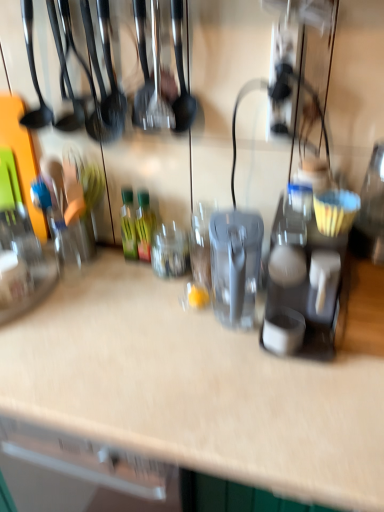
Question: Does green glass bottle at center, the 2th bottle when ordered from right to left, turn towards matte gray coffee maker at center right?

Choices:
 (A) yes
 (B) no

Answer: (B)

Question: Can we say green glass bottle at center, positioned as the first bottle in left-to-right order, lies outside matte gray coffee maker at center right?

Choices:
 (A) no
 (B) yes

Answer: (B)

Question: Does green glass bottle at center, the 2th bottle when ordered from right to left, have a greater width compared to matte gray coffee maker at center right?

Choices:
 (A) no
 (B) yes

Answer: (A)

Question: From the image's perspective, is green glass bottle at center, positioned as the first bottle in left-to-right order, located beneath matte gray coffee maker at center right?

Choices:
 (A) yes
 (B) no

Answer: (B)

Question: Does green glass bottle at center, the 2th bottle when ordered from right to left, have a greater height compared to matte gray coffee maker at center right?

Choices:
 (A) no
 (B) yes

Answer: (A)

Question: Is green glass bottle at center, positioned as the first bottle in left-to-right order, not near matte gray coffee maker at center right?

Choices:
 (A) yes
 (B) no

Answer: (B)

Question: Would you say green glass bottle at center, the 2th bottle viewed from the left, contains green glass bottle at center, the 2th bottle when ordered from right to left?

Choices:
 (A) yes
 (B) no

Answer: (B)

Question: Is the position of green glass bottle at center, the 2th bottle viewed from the left, more distant than that of green glass bottle at center, positioned as the first bottle in left-to-right order?

Choices:
 (A) no
 (B) yes

Answer: (A)

Question: Is green glass bottle at center, which ranks as the first bottle in right-to-left order, oriented towards green glass bottle at center, the 2th bottle when ordered from right to left?

Choices:
 (A) yes
 (B) no

Answer: (B)

Question: Is green glass bottle at center, which ranks as the first bottle in right-to-left order, closer to camera compared to green glass bottle at center, the 2th bottle when ordered from right to left?

Choices:
 (A) no
 (B) yes

Answer: (B)

Question: From a real-world perspective, is green glass bottle at center, which ranks as the first bottle in right-to-left order, beneath green glass bottle at center, the 2th bottle when ordered from right to left?

Choices:
 (A) yes
 (B) no

Answer: (A)

Question: Is green glass bottle at center, the 2th bottle viewed from the left, at the left side of green glass bottle at center, positioned as the first bottle in left-to-right order?

Choices:
 (A) no
 (B) yes

Answer: (A)

Question: Is matte gray coffee maker at center right shorter than green glass bottle at center, which ranks as the first bottle in right-to-left order?

Choices:
 (A) no
 (B) yes

Answer: (A)